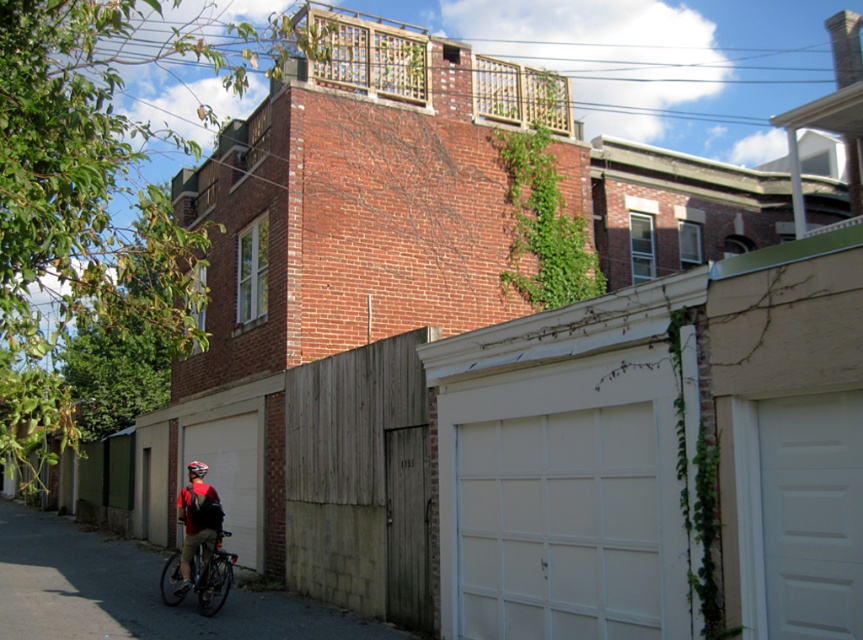
Can you confirm if white painted wood garage door at lower center is smaller than red helmeted cyclist at lower left?

Actually, white painted wood garage door at lower center might be larger than red helmeted cyclist at lower left.

Image resolution: width=863 pixels, height=640 pixels. In order to click on white painted wood garage door at lower center in this screenshot , I will do `click(564, 500)`.

Locate an element on the screen. white painted wood garage door at lower center is located at coordinates (564, 500).

From the picture: Can you confirm if matte black bicycle at lower left is bigger than red helmeted cyclist at lower left?

Yes.

Does matte black bicycle at lower left have a lesser width compared to red helmeted cyclist at lower left?

In fact, matte black bicycle at lower left might be wider than red helmeted cyclist at lower left.

Is point (218, 556) farther from viewer compared to point (186, 544)?

No, it is not.

Identify the location of matte black bicycle at lower left. This screenshot has width=863, height=640. (x=200, y=577).

Which is in front, point (539, 396) or point (165, 573)?

Positioned in front is point (539, 396).

Who is positioned more to the right, white painted wood garage door at lower center or matte black bicycle at lower left?

Positioned to the right is white painted wood garage door at lower center.

Measure the distance between white painted wood garage door at lower center and camera.

They are 6.00 meters apart.

Image resolution: width=863 pixels, height=640 pixels. What are the coordinates of `white painted wood garage door at lower center` in the screenshot? It's located at (564, 500).